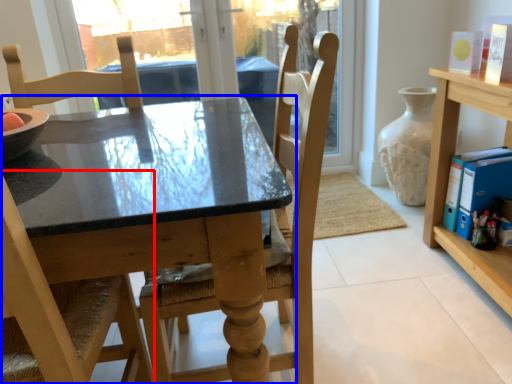
Question: Which point is closer to the camera, chair (highlighted by a red box) or table (highlighted by a blue box)?

Choices:
 (A) chair
 (B) table

Answer: (A)